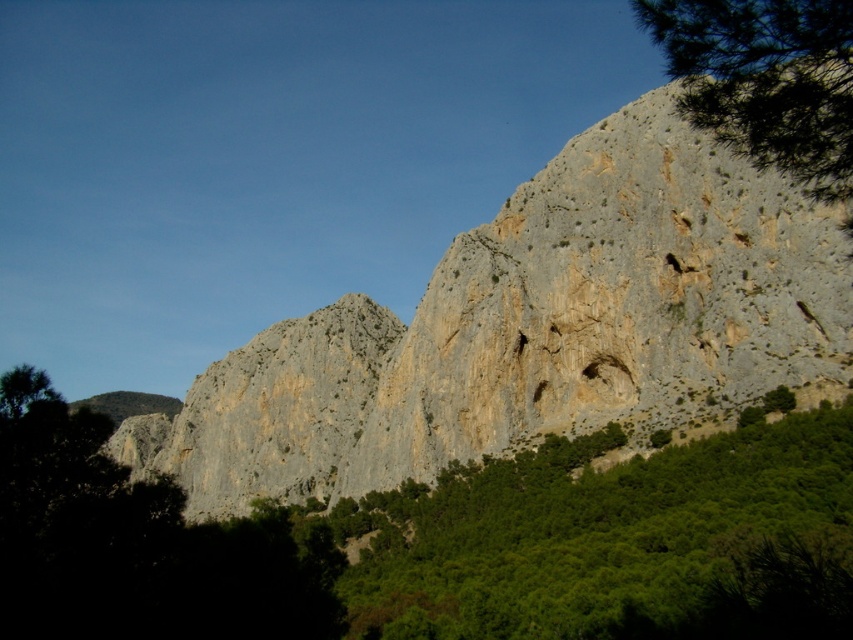
You are a hiker standing at the base of the cliffs and see the green leafy tree at center and the green leafy tree at upper right. Which tree is closer to you?

The green leafy tree at center is closer to you because it is positioned below the green leafy tree at upper right, indicating it is lower in elevation and thus nearer to your vantage point at the base of the cliffs.

You are a hiker trying to navigate through the rugged landscape. You see the gray rock formation at center and the green leafy tree at center. Which one would you find easier to climb?

The gray rock formation at center has a larger size compared to the green leafy tree at center, so it might be easier to climb due to its stable and sturdy structure.

You are a hiker who wants to cross between the gray rock formation at center and the green leafy tree at center. The path between them is narrow. If your backpack is 1.5 meters wide, can you safely pass through the gap between them?

The gray rock formation at center and green leafy tree at center are 33.65 meters apart from each other. Since the gap between them is much wider than your backpack which is 1.5 meters wide, you can safely pass through the gap.